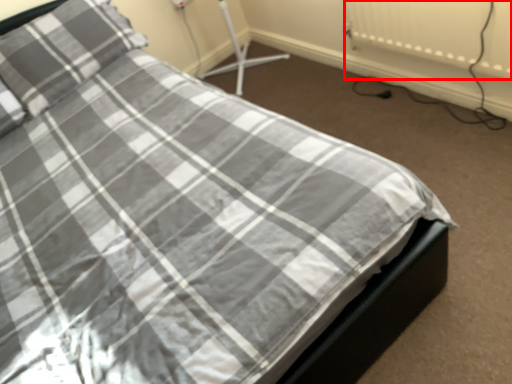
Question: From the image's perspective, what is the correct spatial positioning of radiator (annotated by the red box) in reference to pillow?

Choices:
 (A) below
 (B) above

Answer: (A)